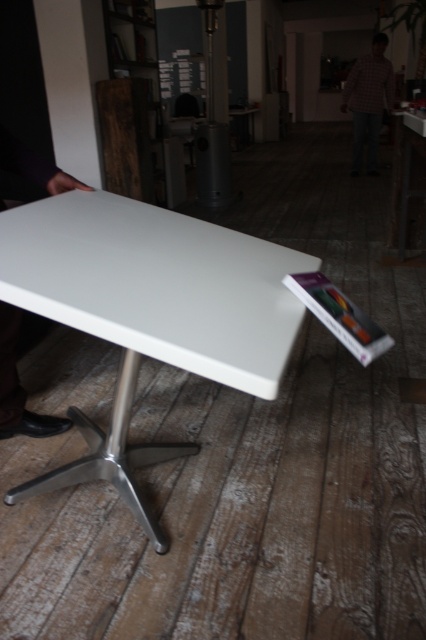
Question: Is white glossy table at right closer to camera compared to checkered shirt at center?

Choices:
 (A) yes
 (B) no

Answer: (A)

Question: Which point is closer to the camera?

Choices:
 (A) white glossy table at center
 (B) checkered shirt at center

Answer: (A)

Question: Which point is farther to the camera?

Choices:
 (A) (49, 486)
 (B) (397, 170)

Answer: (B)

Question: Which point appears farthest from the camera in this image?

Choices:
 (A) (408, 109)
 (B) (247, 320)
 (C) (354, 61)

Answer: (C)

Question: Can you confirm if white glossy table at center is thinner than white glossy table at right?

Choices:
 (A) no
 (B) yes

Answer: (A)

Question: Observing the image, what is the correct spatial positioning of white glossy table at center in reference to white glossy table at right?

Choices:
 (A) above
 (B) below

Answer: (B)